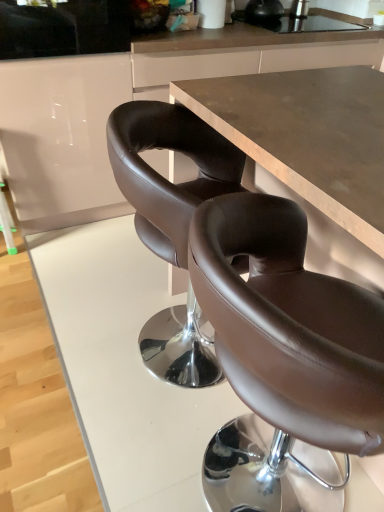
At what (x,y) coordinates should I click in order to perform the action: click on vacant space that's between white glossy cabinet at upper left and brown leather bar stool at left. Please return your answer as a coordinate pair (x, y). Looking at the image, I should click on (64, 240).